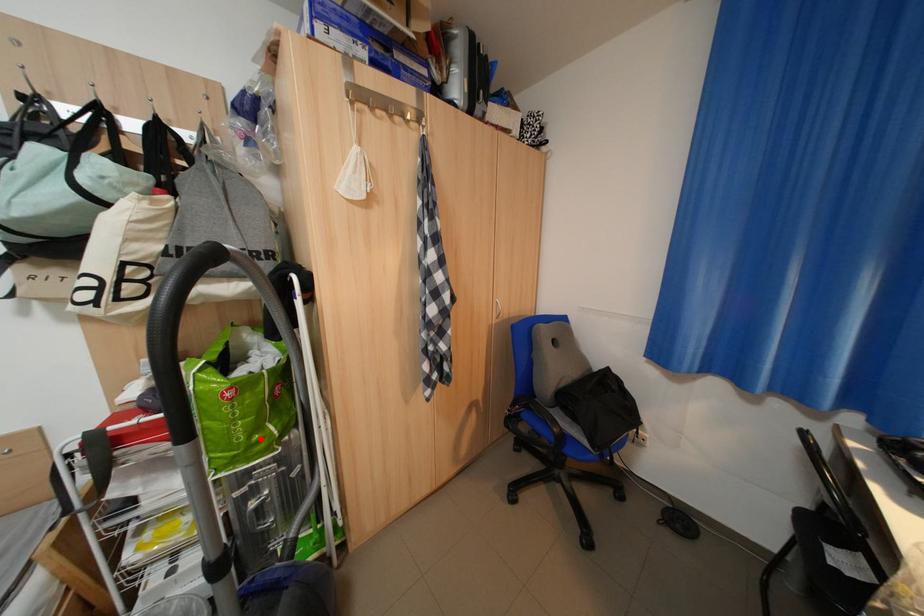
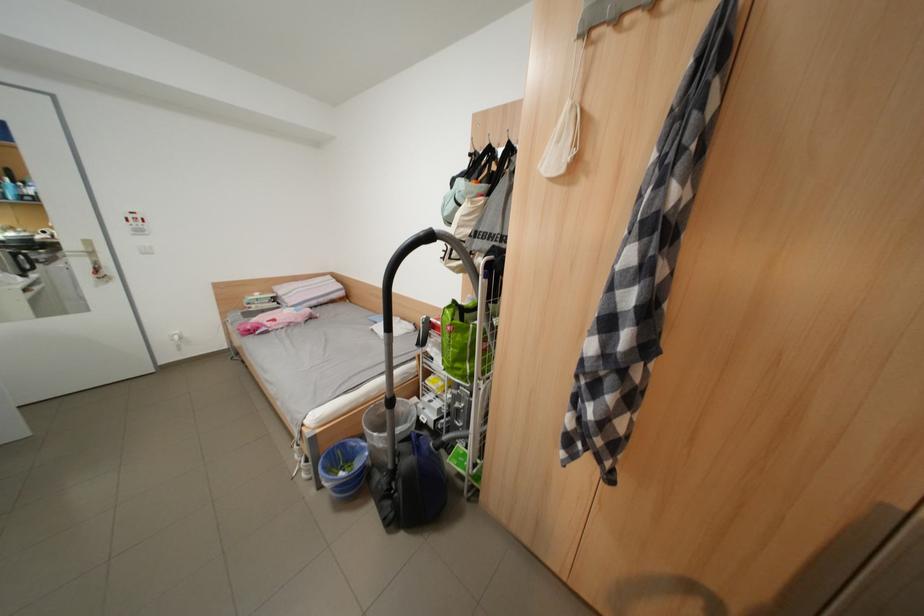
Question: I am providing you with two images of the same scene from different viewpoints. In image1, a red point is highlighted. Considering the same 3D point in image2, which of the following is correct?

Choices:
 (A) It is closer
 (B) It is farther

Answer: (B)